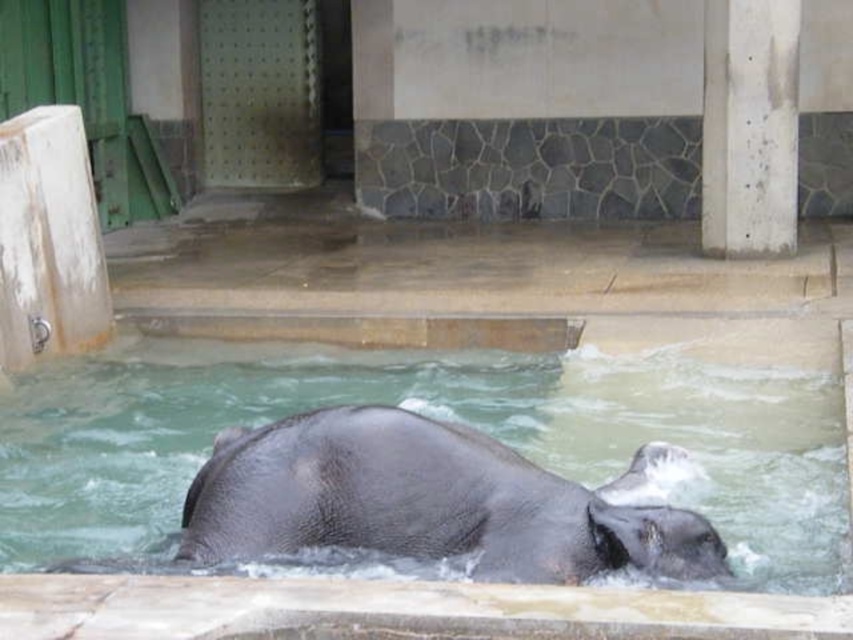
Question: Considering the relative positions of gray matte water at center and white concrete pillar at upper right in the image provided, where is gray matte water at center located with respect to white concrete pillar at upper right?

Choices:
 (A) below
 (B) above

Answer: (A)

Question: Does gray matte water at center appear over white concrete pillar at upper right?

Choices:
 (A) no
 (B) yes

Answer: (A)

Question: Which of the following is the farthest from the observer?

Choices:
 (A) gray textured elephant at center
 (B) white concrete pillar at upper right
 (C) gray matte water at center

Answer: (B)

Question: Which is nearer to the white concrete pillar at upper right?

Choices:
 (A) gray textured elephant at center
 (B) gray matte water at center

Answer: (B)

Question: Based on their relative distances, which object is nearer to the white concrete pillar at upper right?

Choices:
 (A) gray matte water at center
 (B) gray textured elephant at center

Answer: (A)

Question: Is gray matte water at center smaller than gray textured elephant at center?

Choices:
 (A) yes
 (B) no

Answer: (B)